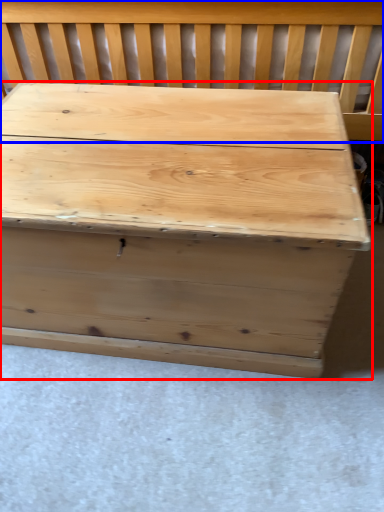
Question: Which of the following is the farthest to the observer, table (highlighted by a red box) or church bench (highlighted by a blue box)?

Choices:
 (A) table
 (B) church bench

Answer: (B)